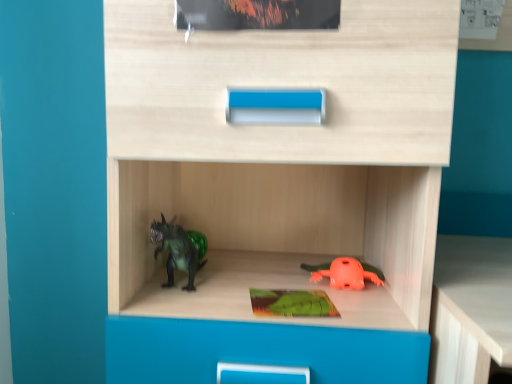
Question: From a real-world perspective, is green matte dinosaur at left, positioned as the second toy in right-to-left order, positioned under green matte paperback book at center based on gravity?

Choices:
 (A) no
 (B) yes

Answer: (A)

Question: Is green matte dinosaur at left, positioned as the second toy in right-to-left order, at the right side of green matte paperback book at center?

Choices:
 (A) no
 (B) yes

Answer: (A)

Question: Considering the relative positions of green matte dinosaur at left, positioned as the second toy in right-to-left order, and green matte paperback book at center in the image provided, is green matte dinosaur at left, positioned as the second toy in right-to-left order, to the left of green matte paperback book at center from the viewer's perspective?

Choices:
 (A) yes
 (B) no

Answer: (A)

Question: Is the depth of green matte dinosaur at left, acting as the first toy starting from the left, greater than that of green matte paperback book at center?

Choices:
 (A) yes
 (B) no

Answer: (A)

Question: Would you consider green matte dinosaur at left, acting as the first toy starting from the left, to be distant from green matte paperback book at center?

Choices:
 (A) yes
 (B) no

Answer: (B)

Question: Is green matte dinosaur at left, acting as the first toy starting from the left, bigger than green matte paperback book at center?

Choices:
 (A) yes
 (B) no

Answer: (A)

Question: Does green matte paperback book at center have a greater width compared to orange matte frog at lower center, placed as the first toy when sorted from right to left?

Choices:
 (A) yes
 (B) no

Answer: (B)

Question: Is green matte paperback book at center further to camera compared to orange matte frog at lower center, placed as the 2th toy when sorted from left to right?

Choices:
 (A) yes
 (B) no

Answer: (B)

Question: Is green matte paperback book at center thinner than orange matte frog at lower center, placed as the first toy when sorted from right to left?

Choices:
 (A) no
 (B) yes

Answer: (B)

Question: Is orange matte frog at lower center, placed as the first toy when sorted from right to left, at the back of green matte paperback book at center?

Choices:
 (A) yes
 (B) no

Answer: (B)

Question: Can you confirm if green matte paperback book at center is bigger than orange matte frog at lower center, placed as the first toy when sorted from right to left?

Choices:
 (A) yes
 (B) no

Answer: (B)

Question: Is green matte paperback book at center smaller than orange matte frog at lower center, placed as the 2th toy when sorted from left to right?

Choices:
 (A) no
 (B) yes

Answer: (B)

Question: Can you confirm if green matte paperback book at center is wider than green matte dinosaur at left, acting as the first toy starting from the left?

Choices:
 (A) no
 (B) yes

Answer: (A)